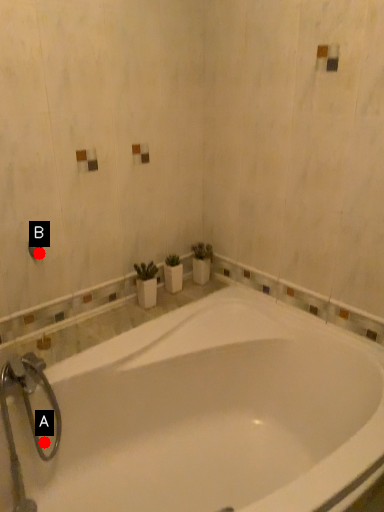
Question: Two points are circled on the image, labeled by A and B beside each circle. Among these points, which one is nearest to the camera?

Choices:
 (A) A is closer
 (B) B is closer

Answer: (A)